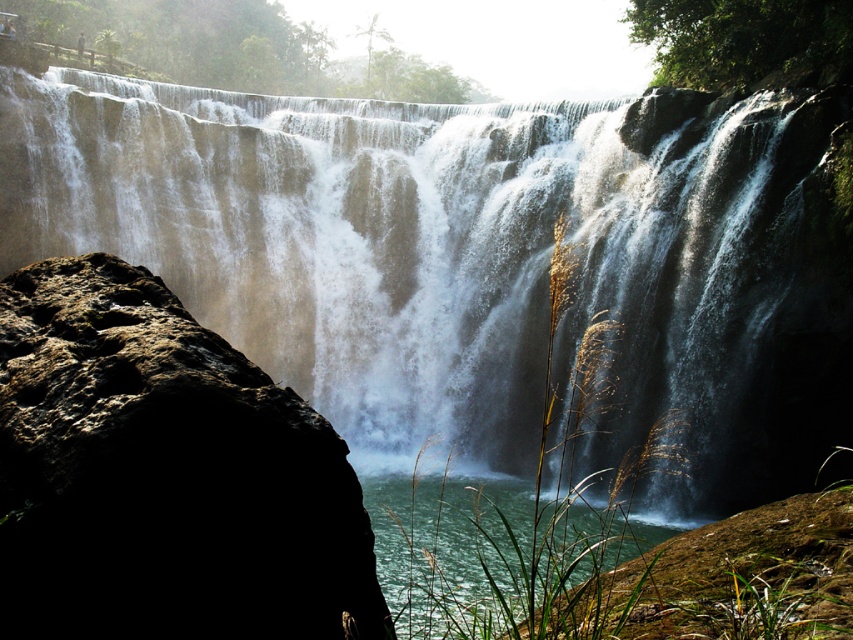
Based on the photo, you are standing at the edge of the waterfall and see a point marked at coordinates (x=459, y=262). Based on the scene, what is the location of this point relative to the waterfall and its surroundings?

The point at coordinates (x=459, y=262) corresponds to white frothy water at center, which is where the waterfall crashes against the rocks, creating its dynamic display.

You are standing at the edge of the pool and want to cross to the other side. There are two water areas in front of you. One is the white frothy water at center and the other is the clear water at lower center. Which water area should you avoid stepping into if you want to cross safely?

You should avoid stepping into the white frothy water at center because it is to the left of the clear water at lower center, indicating it is closer to the waterfall where the water is more turbulent and dangerous.